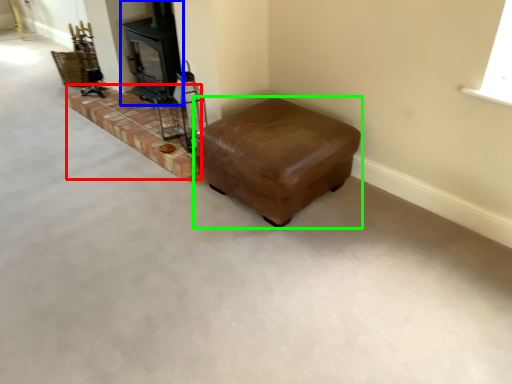
Question: Based on their relative distances, which object is farther from stairwell (highlighted by a red box)? Choose from wood burning stove (highlighted by a blue box) and furniture (highlighted by a green box).

Choices:
 (A) wood burning stove
 (B) furniture

Answer: (B)